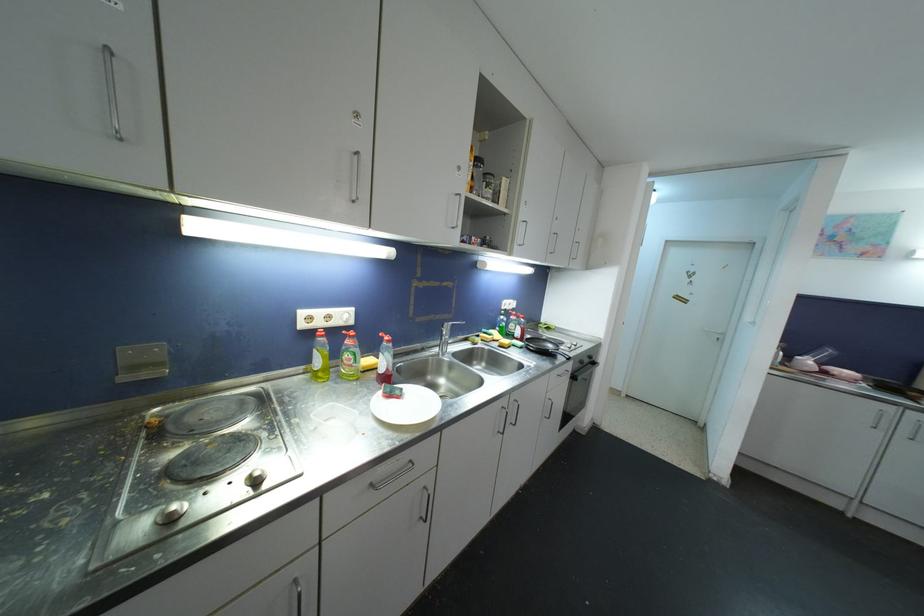
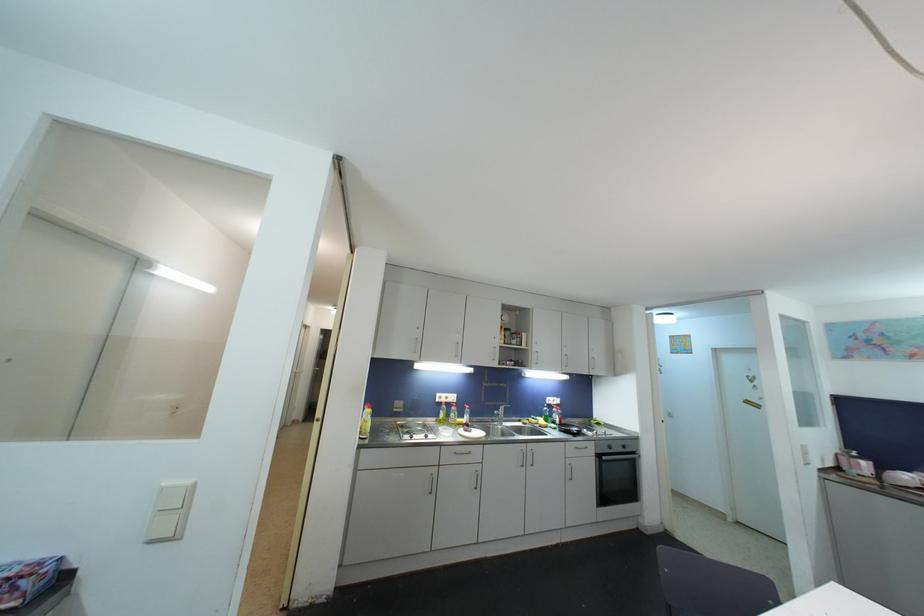
In the second image, find the point that corresponds to the point at 305,328 in the first image.

(441, 403)